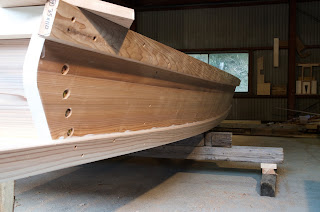
At what (x,y) coordinates should I click in order to perform the action: click on wall. Please return your answer as a coordinate pair (x, y). Looking at the image, I should click on (152, 24), (194, 24), (260, 21), (269, 109), (237, 107).